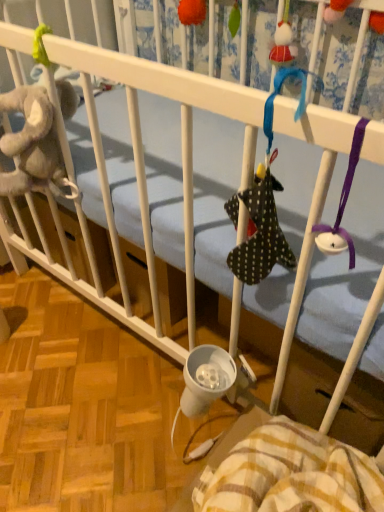
Question: Which direction should I rotate to look at polka dot fabric sock at upper center, the second toy from the left?

Choices:
 (A) right
 (B) left

Answer: (A)

Question: From the image's perspective, does polka dot fabric sock at upper center, the first toy ordered from the bottom, appear higher than yellow plaid blanket at lower right?

Choices:
 (A) yes
 (B) no

Answer: (A)

Question: Can yellow plaid blanket at lower right be found inside polka dot fabric sock at upper center, which ranks as the 2th toy in back-to-front order?

Choices:
 (A) no
 (B) yes

Answer: (A)

Question: Is polka dot fabric sock at upper center, the second toy from the left, at the right side of yellow plaid blanket at lower right?

Choices:
 (A) yes
 (B) no

Answer: (A)

Question: Does polka dot fabric sock at upper center, the second toy positioned from the top, have a lesser width compared to yellow plaid blanket at lower right?

Choices:
 (A) no
 (B) yes

Answer: (B)

Question: Can you confirm if polka dot fabric sock at upper center, the first toy ordered from the bottom, is positioned to the left of yellow plaid blanket at lower right?

Choices:
 (A) no
 (B) yes

Answer: (A)

Question: Is polka dot fabric sock at upper center, the second toy positioned from the top, placed right next to yellow plaid blanket at lower right?

Choices:
 (A) no
 (B) yes

Answer: (A)

Question: Is orange fuzzy ball at upper center, placed as the second toy when sorted from bottom to top, turned away from polka dot fabric sock at upper center, which is counted as the 1th toy, starting from the front?

Choices:
 (A) no
 (B) yes

Answer: (A)

Question: From the image's perspective, is orange fuzzy ball at upper center, the first toy from the back, beneath polka dot fabric sock at upper center, the second toy from the left?

Choices:
 (A) no
 (B) yes

Answer: (A)

Question: Is there a large distance between orange fuzzy ball at upper center, the first toy positioned from the left, and polka dot fabric sock at upper center, acting as the first toy starting from the right?

Choices:
 (A) yes
 (B) no

Answer: (B)

Question: Can you confirm if orange fuzzy ball at upper center, the 2th toy when ordered from front to back, is shorter than polka dot fabric sock at upper center, which ranks as the 2th toy in back-to-front order?

Choices:
 (A) no
 (B) yes

Answer: (A)

Question: From the image's perspective, is orange fuzzy ball at upper center, marked as the second toy in a right-to-left arrangement, over polka dot fabric sock at upper center, the second toy from the left?

Choices:
 (A) yes
 (B) no

Answer: (A)

Question: From a real-world perspective, does orange fuzzy ball at upper center, the first toy positioned from the left, sit lower than polka dot fabric sock at upper center, which ranks as the 2th toy in back-to-front order?

Choices:
 (A) yes
 (B) no

Answer: (B)

Question: Does yellow plaid blanket at lower right have a smaller size compared to orange fuzzy ball at upper center, which is counted as the 1th toy, starting from the top?

Choices:
 (A) no
 (B) yes

Answer: (A)